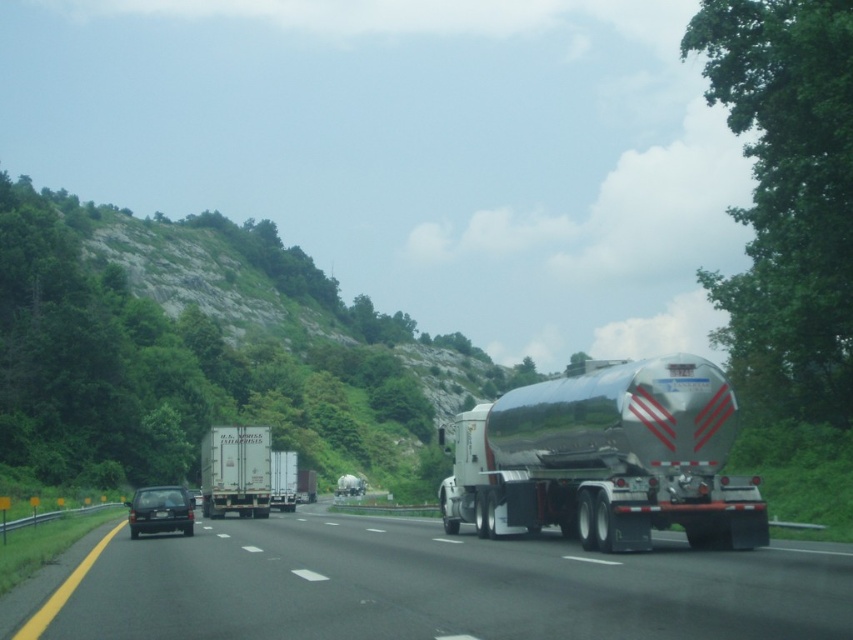
Does point (714, 621) come in front of point (132, 536)?

Yes, it is in front of point (132, 536).

Can you confirm if silver metallic tanker truck at center-right is positioned to the left of matte black car at center?

In fact, silver metallic tanker truck at center-right is to the right of matte black car at center.

Identify the location of silver metallic tanker truck at center-right. (434, 586).

Locate an element on the screen. rocky terrain at upper left is located at coordinates (206, 353).

Which is above, rocky terrain at upper left or white matte trailer at center?

rocky terrain at upper left

Does point (316, 456) lie in front of point (285, 477)?

No, it is not.

Where is `rocky terrain at upper left`? rocky terrain at upper left is located at coordinates (206, 353).

Is the position of rocky terrain at upper left less distant than that of shiny metallic tanker at right?

No, it is behind shiny metallic tanker at right.

Image resolution: width=853 pixels, height=640 pixels. Find the location of `rocky terrain at upper left`. rocky terrain at upper left is located at coordinates (206, 353).

Locate an element on the screen. This screenshot has height=640, width=853. rocky terrain at upper left is located at coordinates (206, 353).